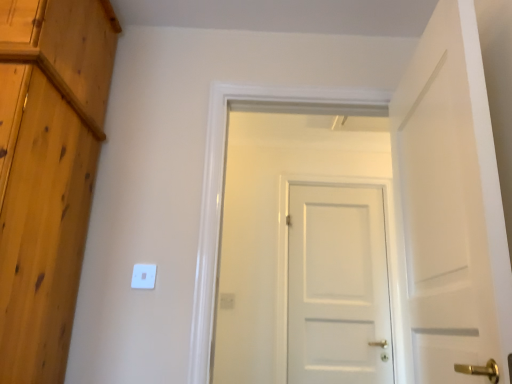
Question: Is white plastic light switch at center bigger than white plastic electric outlet at center?

Choices:
 (A) yes
 (B) no

Answer: (B)

Question: Considering the relative sizes of white plastic light switch at center and white plastic electric outlet at center in the image provided, is white plastic light switch at center thinner than white plastic electric outlet at center?

Choices:
 (A) no
 (B) yes

Answer: (B)

Question: Considering the relative sizes of white plastic light switch at center and white plastic electric outlet at center in the image provided, is white plastic light switch at center wider than white plastic electric outlet at center?

Choices:
 (A) yes
 (B) no

Answer: (B)

Question: From a real-world perspective, is white plastic light switch at center physically below white plastic electric outlet at center?

Choices:
 (A) yes
 (B) no

Answer: (B)

Question: Does white plastic light switch at center have a smaller size compared to white plastic electric outlet at center?

Choices:
 (A) yes
 (B) no

Answer: (A)

Question: From a real-world perspective, is white plastic electric outlet at center physically located above or below white matte door at center, the 1th door when ordered from front to back?

Choices:
 (A) below
 (B) above

Answer: (A)

Question: Is white plastic electric outlet at center spatially inside white matte door at center, the 1th door when ordered from front to back, or outside of it?

Choices:
 (A) outside
 (B) inside

Answer: (A)

Question: Is white plastic electric outlet at center in front of or behind white matte door at center, the 1th door when ordered from front to back, in the image?

Choices:
 (A) behind
 (B) front

Answer: (A)

Question: Is white plastic electric outlet at center bigger or smaller than white matte door at center, the 1th door when ordered from front to back?

Choices:
 (A) big
 (B) small

Answer: (B)

Question: Looking at their shapes, would you say white matte door at center, the 2th door viewed from the back, is wider or thinner than white plastic electric outlet at center?

Choices:
 (A) thin
 (B) wide

Answer: (B)

Question: Considering the positions of white matte door at center, the second door in the front-to-back sequence, and white plastic electric outlet at center in the image, is white matte door at center, the second door in the front-to-back sequence, taller or shorter than white plastic electric outlet at center?

Choices:
 (A) tall
 (B) short

Answer: (A)

Question: Looking at the image, does white matte door at center, the second door in the front-to-back sequence, seem bigger or smaller compared to white plastic electric outlet at center?

Choices:
 (A) big
 (B) small

Answer: (A)

Question: In the image, is white matte door at center, the second door in the front-to-back sequence, positioned in front of or behind white plastic electric outlet at center?

Choices:
 (A) behind
 (B) front

Answer: (B)

Question: From a real-world perspective, relative to white plastic light switch at center, is white plastic electric outlet at center vertically above or below?

Choices:
 (A) below
 (B) above

Answer: (A)

Question: Is white plastic electric outlet at center in front of or behind white plastic light switch at center in the image?

Choices:
 (A) front
 (B) behind

Answer: (B)